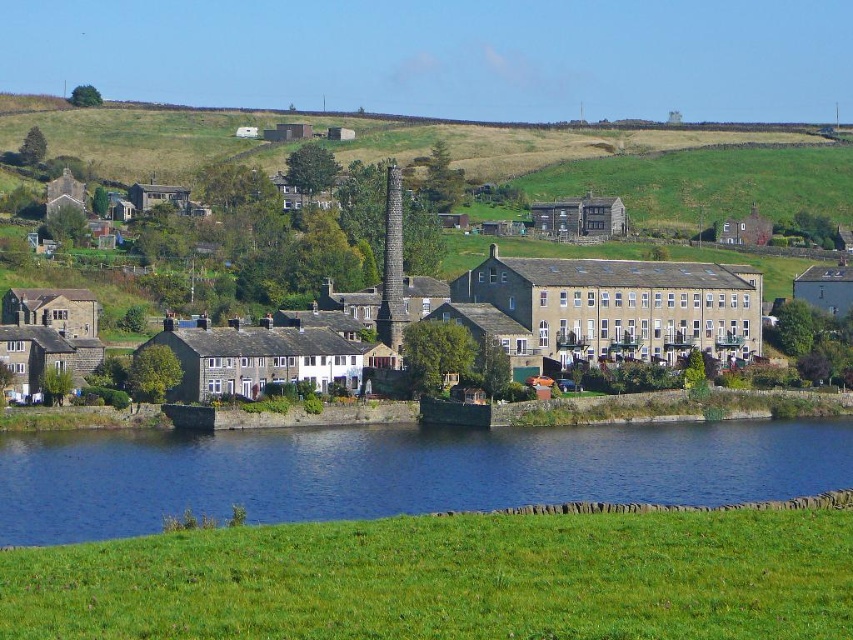
Based on the photo, you are standing on the grassy slope near the stone wall and want to reach the blue water at lower center. Which direction should you walk to avoid passing through the stone buildings at center?

Since the blue water at lower center is positioned under the stone buildings at center, you should walk towards the direction away from the stone buildings to reach the blue water without passing through them. Alternatively, you can go around the stone buildings at center to access the blue water at lower center.

You are standing in the rural landscape scene and want to place a small flag at each of the two points labeled point (590, 429) and point (488, 296). Which point will have its flag appear larger in the image?

Point (590, 429) is closer to the camera than point (488, 296), so the flag placed at point (590, 429) will appear larger in the image.

You are a photographer planning to capture the stone buildings at center and the blue water at lower center in a single frame. Based on their sizes in the image, which object should you focus on first to ensure both are clearly visible in your composition?

The stone buildings at center are larger than the blue water at lower center, so focusing on them first will help balance the composition and ensure both elements are visible.